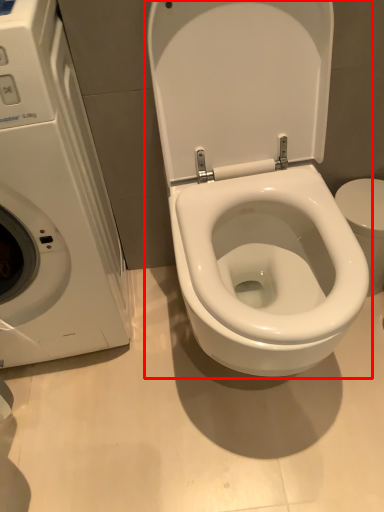
Question: Considering the relative positions of toilet (annotated by the red box) and washing machine in the image provided, where is toilet (annotated by the red box) located with respect to the staircase?

Choices:
 (A) left
 (B) right

Answer: (B)